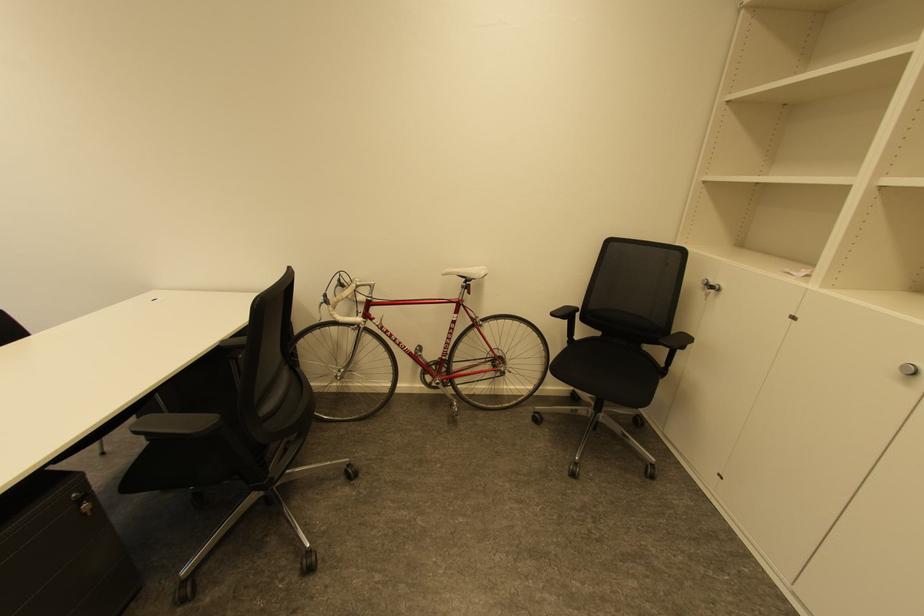
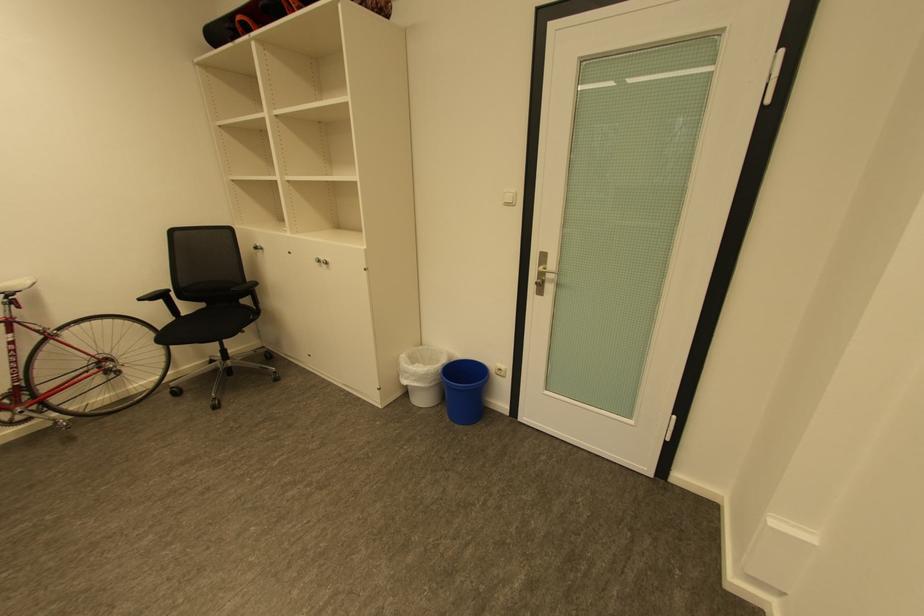
The point at [719,288] is marked in the first image. Where is the corresponding point in the second image?

(262, 248)